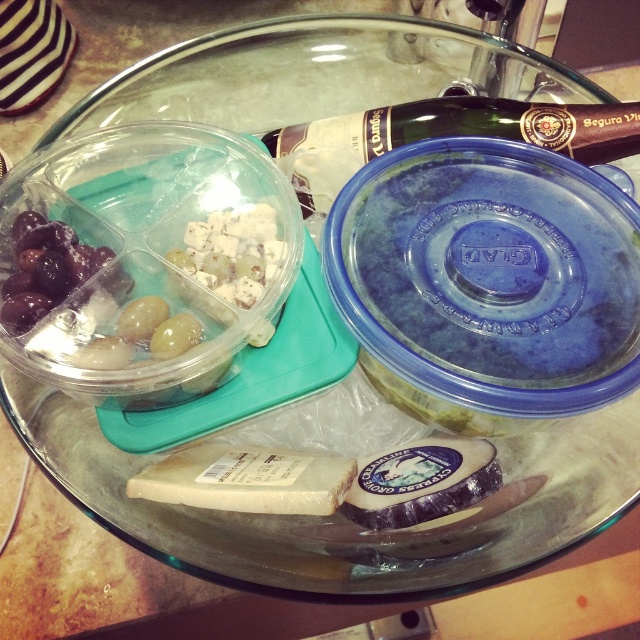
Which of these two, blue plastic bowl at center or dark purple grapes at left, stands shorter?

dark purple grapes at left

Is point (360, 340) behind point (42, 256)?

No, (360, 340) is in front of (42, 256).

Describe the element at coordinates (486, 282) in the screenshot. I see `blue plastic bowl at center` at that location.

Locate an element on the screen. The width and height of the screenshot is (640, 640). blue plastic bowl at center is located at coordinates (486, 282).

Does point (358, 512) come behind point (38, 280)?

No, it is not.

Between blue creamy cheese at center and dark purple grapes at left, which one is positioned lower?

Positioned lower is blue creamy cheese at center.

This screenshot has width=640, height=640. What do you see at coordinates (420, 483) in the screenshot? I see `blue creamy cheese at center` at bounding box center [420, 483].

This screenshot has width=640, height=640. In order to click on blue creamy cheese at center in this screenshot , I will do `click(420, 483)`.

Is white creamy cheese at center positioned before blue creamy cheese at center?

Yes, white creamy cheese at center is in front of blue creamy cheese at center.

Find the location of a particular element. Image resolution: width=640 pixels, height=640 pixels. white creamy cheese at center is located at coordinates (248, 480).